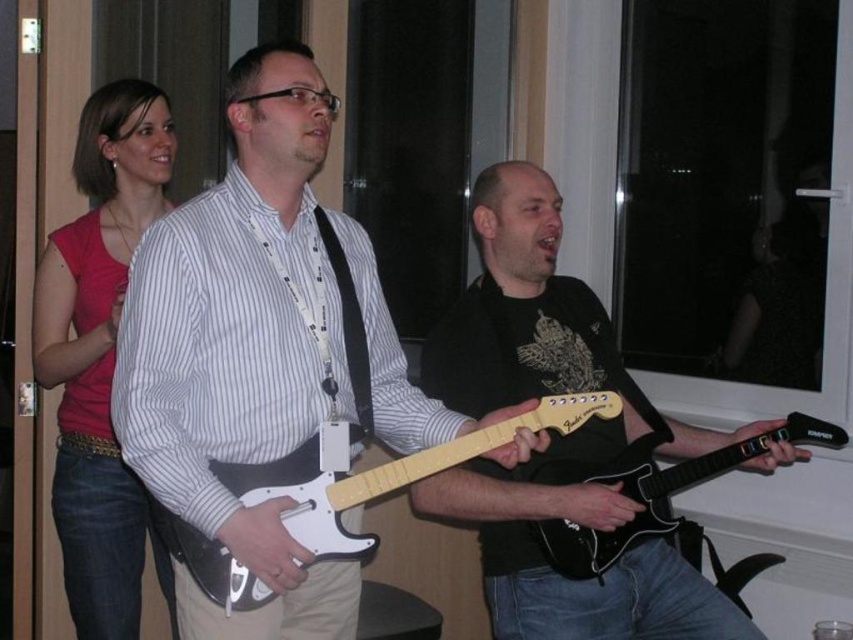
Is white matte electric guitar at center taller than black matte electric guitar at center?

Correct, white matte electric guitar at center is much taller as black matte electric guitar at center.

Describe the element at coordinates (410, 472) in the screenshot. I see `white matte electric guitar at center` at that location.

This screenshot has height=640, width=853. Find the location of `white matte electric guitar at center`. white matte electric guitar at center is located at coordinates (410, 472).

Between black matte guitar at center and pink fabric shirt at upper left, which one has more height?

pink fabric shirt at upper left is taller.

Does point (578, 432) come in front of point (91, 570)?

Yes, point (578, 432) is closer to viewer.

Who is more distant from viewer, (502, 528) or (90, 580)?

Positioned behind is point (90, 580).

Locate an element on the screen. The height and width of the screenshot is (640, 853). black matte guitar at center is located at coordinates (556, 436).

Which is below, white matte guitar at center or black matte guitar at center?

→ Positioned lower is black matte guitar at center.

Is white matte guitar at center thinner than black matte guitar at center?

Indeed, white matte guitar at center has a lesser width compared to black matte guitar at center.

Where is `white matte guitar at center`? white matte guitar at center is located at coordinates (242, 352).